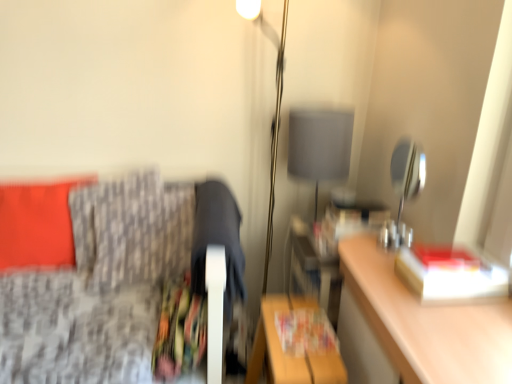
The height and width of the screenshot is (384, 512). Find the location of `free space in front of printed paper magazine at lower center, which ranks as the first magazine in bottom-to-top order`. free space in front of printed paper magazine at lower center, which ranks as the first magazine in bottom-to-top order is located at coordinates (310, 357).